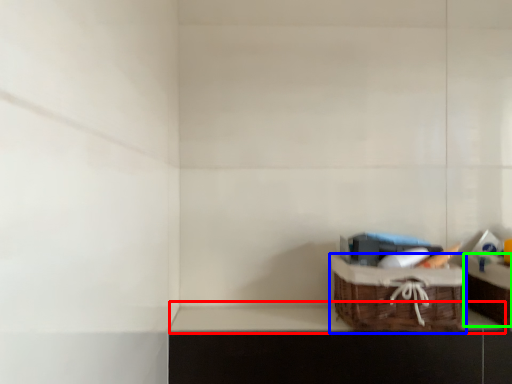
Question: Which is nearer to the window sill (highlighted by a red box)? picnic basket (highlighted by a blue box) or cabinetry (highlighted by a green box).

Choices:
 (A) picnic basket
 (B) cabinetry

Answer: (A)